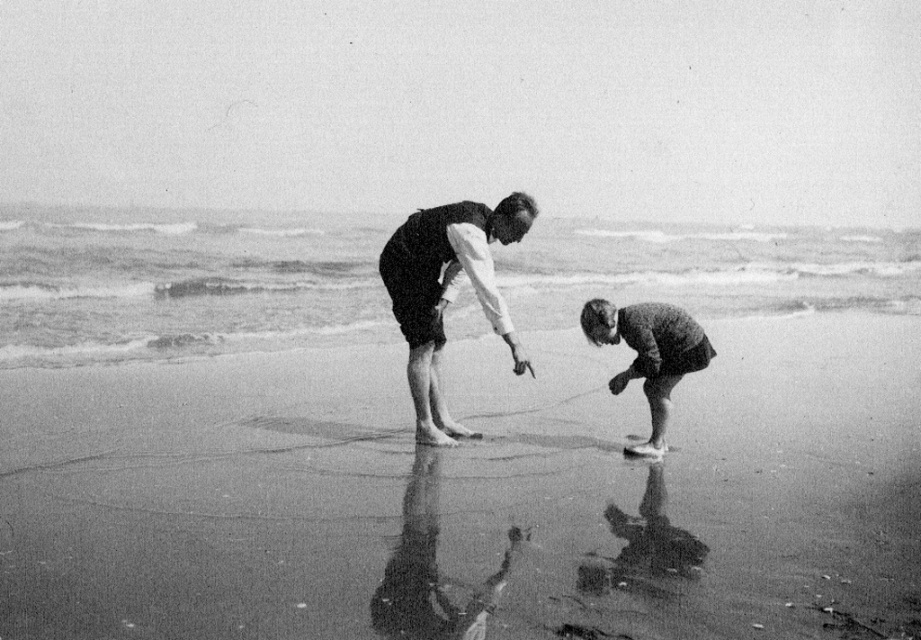
Between smooth sand at lower center and smooth fabric shorts at center, which one appears on the right side from the viewer's perspective?

smooth sand at lower center

Can you confirm if smooth sand at lower center is taller than smooth fabric shorts at center?

In fact, smooth sand at lower center may be shorter than smooth fabric shorts at center.

Is point (253, 456) closer to camera compared to point (456, 260)?

Yes.

Where is `smooth sand at lower center`? The width and height of the screenshot is (921, 640). smooth sand at lower center is located at coordinates (465, 493).

Is smooth sand at lower center above coarse wool sweater at lower right?

Incorrect, smooth sand at lower center is not positioned above coarse wool sweater at lower right.

Does point (476, 540) come in front of point (672, 346)?

Yes, point (476, 540) is closer to viewer.

Consider the image. Measure the distance between smooth sand at lower center and camera.

smooth sand at lower center and camera are 13.66 feet apart from each other.

Where is `smooth sand at lower center`? smooth sand at lower center is located at coordinates (465, 493).

Is smooth fabric shorts at center positioned behind coarse wool sweater at lower right?

That is False.

What do you see at coordinates (447, 292) in the screenshot? I see `smooth fabric shorts at center` at bounding box center [447, 292].

The image size is (921, 640). In order to click on smooth fabric shorts at center in this screenshot , I will do `click(447, 292)`.